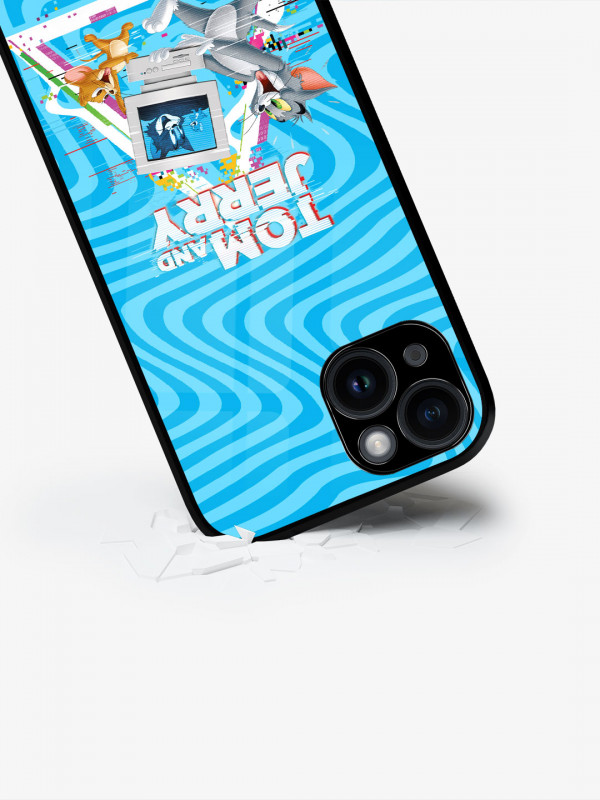
Where is `phone`? The image size is (600, 800). phone is located at coordinates (438, 368).